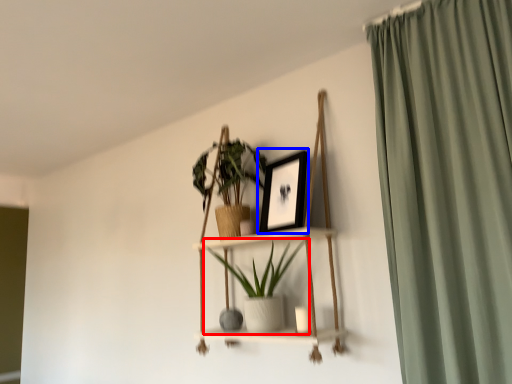
Question: Which of the following is the farthest to the observer, houseplant (highlighted by a red box) or picture frame (highlighted by a blue box)?

Choices:
 (A) houseplant
 (B) picture frame

Answer: (B)